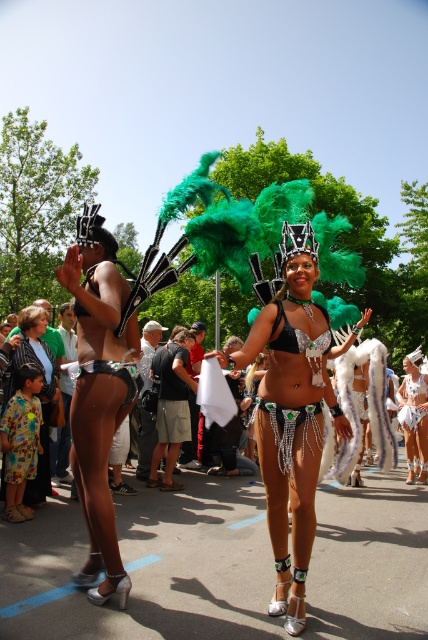
Question: Can you confirm if printed fabric dress at left is positioned below white sequined bikini at center?

Choices:
 (A) yes
 (B) no

Answer: (B)

Question: Does shiny silver bikini top at center appear over white sequined bikini at center?

Choices:
 (A) yes
 (B) no

Answer: (A)

Question: Is matte black bikini at left below printed fabric shirt at lower left?

Choices:
 (A) yes
 (B) no

Answer: (B)

Question: Estimate the real-world distances between objects in this image. Which object is closer to the matte black bikini at left?

Choices:
 (A) white sequined bikini at center
 (B) printed fabric dress at left

Answer: (B)

Question: Considering the real-world distances, which object is farthest from the printed fabric dress at left?

Choices:
 (A) printed fabric shirt at lower left
 (B) shiny silver bikini top at center

Answer: (B)

Question: Which point is closer to the camera?

Choices:
 (A) (398, 413)
 (B) (413, 451)

Answer: (A)